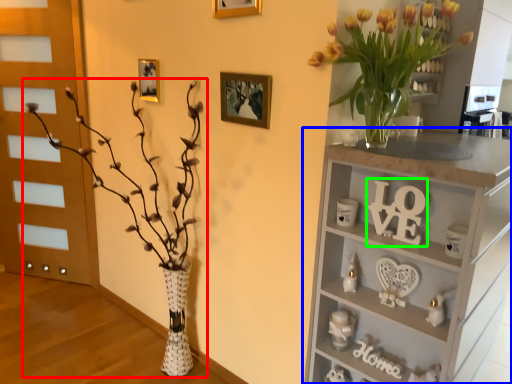
Question: Considering the real-world distances, which object is closest to houseplant (highlighted by a red box)? shelf (highlighted by a blue box) or number (highlighted by a green box).

Choices:
 (A) shelf
 (B) number

Answer: (A)